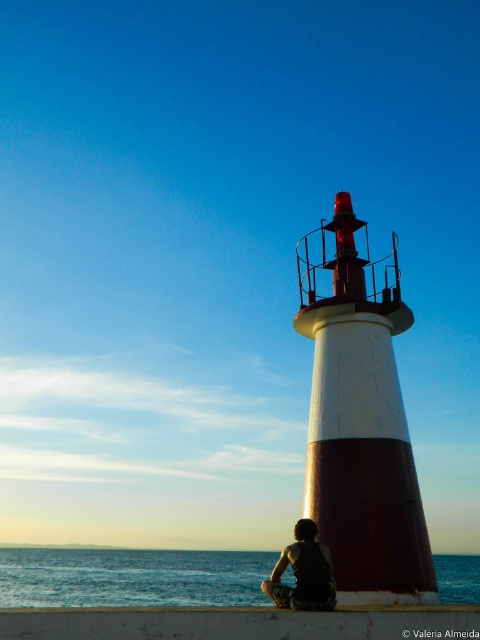
Question: Does blue water at lower left appear over dark hair at lower center?

Choices:
 (A) yes
 (B) no

Answer: (B)

Question: Is white concrete ledge at lower center wider than dark hair at lower center?

Choices:
 (A) yes
 (B) no

Answer: (A)

Question: Among these objects, which one is nearest to the camera?

Choices:
 (A) white concrete ledge at lower center
 (B) dark hair at lower center
 (C) blue water at lower left

Answer: (A)

Question: Among these objects, which one is nearest to the camera?

Choices:
 (A) blue water at lower left
 (B) white concrete ledge at lower center

Answer: (B)

Question: Which object is the closest to the blue water at lower left?

Choices:
 (A) dark hair at lower center
 (B) white concrete ledge at lower center

Answer: (B)

Question: Is blue water at lower left smaller than dark hair at lower center?

Choices:
 (A) yes
 (B) no

Answer: (B)